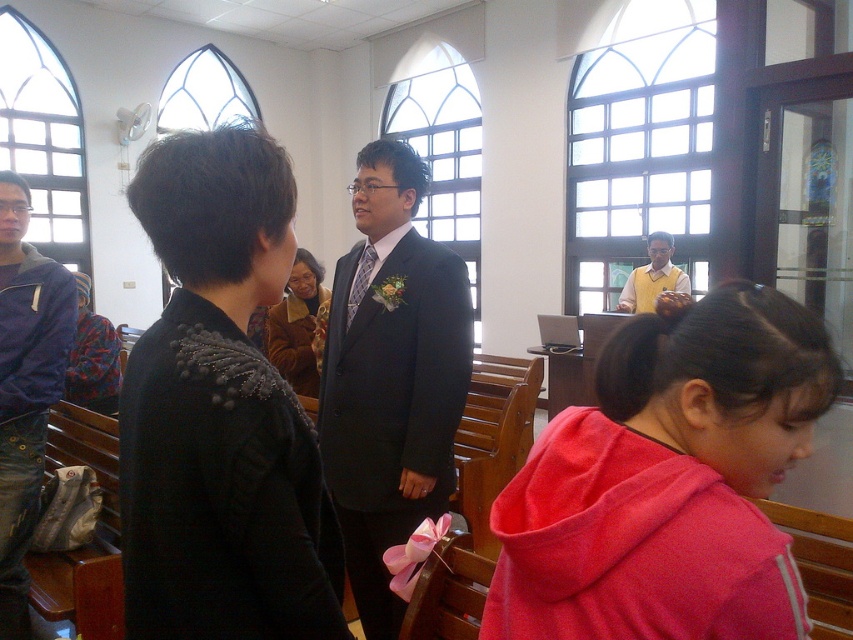
Is brushed metal jacket at left behind yellow matte vest at center?

That is False.

Does point (1, 216) come in front of point (618, 305)?

That is True.

Does point (10, 442) lie behind point (680, 278)?

No, (10, 442) is in front of (680, 278).

Identify the location of brushed metal jacket at left. (25, 387).

In the scene shown: Who is higher up, matte black suit at center or yellow matte vest at center?

yellow matte vest at center is above.

Is point (368, 304) behind point (634, 285)?

No, it is in front of (634, 285).

At what (x,y) coordinates should I click in order to perform the action: click on matte black suit at center. Please return your answer as a coordinate pair (x, y). This screenshot has height=640, width=853. Looking at the image, I should click on (392, 378).

You are a GUI agent. You are given a task and a screenshot of the screen. Output one action in this format:
    pyautogui.click(x=<x>, y=<y>)
    Task: Click on the matte black suit at center
    The height and width of the screenshot is (640, 853).
    Given the screenshot: What is the action you would take?
    pyautogui.click(x=392, y=378)

Which is more to the left, floral-patterned fabric at center or yellow matte vest at center?

floral-patterned fabric at center is more to the left.

Is the position of floral-patterned fabric at center more distant than that of yellow matte vest at center?

No, floral-patterned fabric at center is closer to the viewer.

The width and height of the screenshot is (853, 640). In order to click on floral-patterned fabric at center in this screenshot , I will do `click(91, 356)`.

Locate an element on the screen. This screenshot has height=640, width=853. floral-patterned fabric at center is located at coordinates (91, 356).